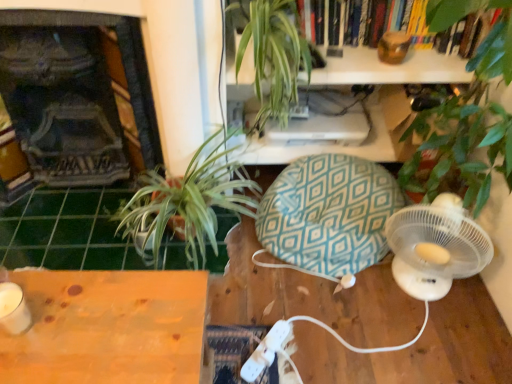
The height and width of the screenshot is (384, 512). Find the location of `vacant space in between white plastic wii controller at lower center and teal diamond-patterned bean bag chair at center`. vacant space in between white plastic wii controller at lower center and teal diamond-patterned bean bag chair at center is located at coordinates (293, 312).